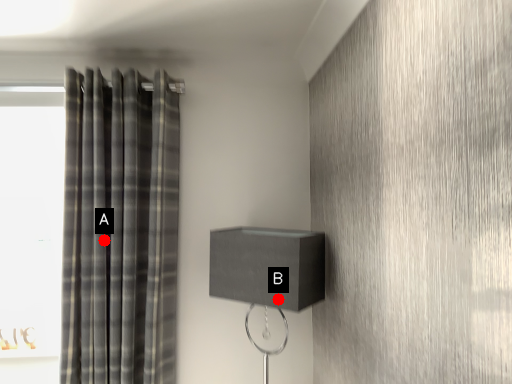
Question: Two points are circled on the image, labeled by A and B beside each circle. Which point is farther to the camera?

Choices:
 (A) A is further
 (B) B is further

Answer: (A)